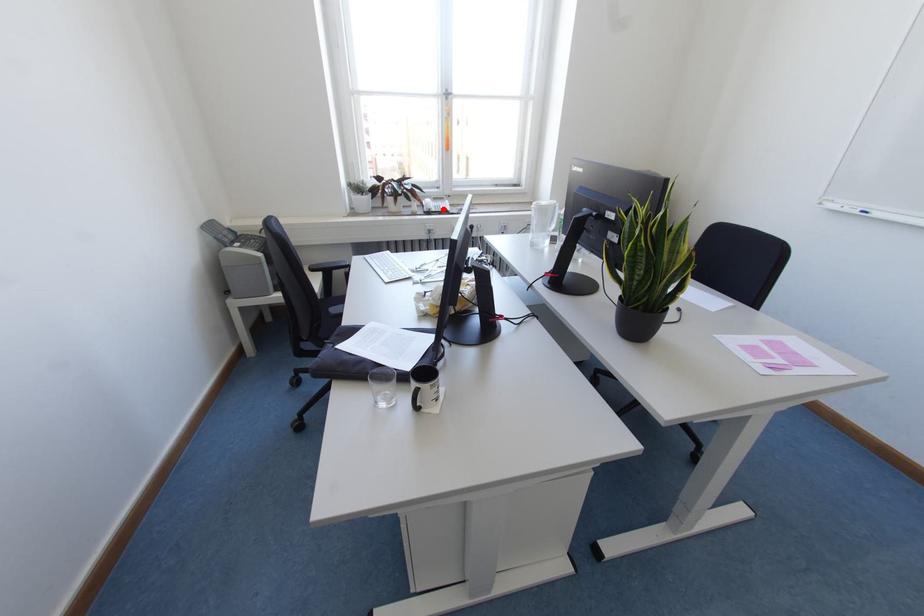
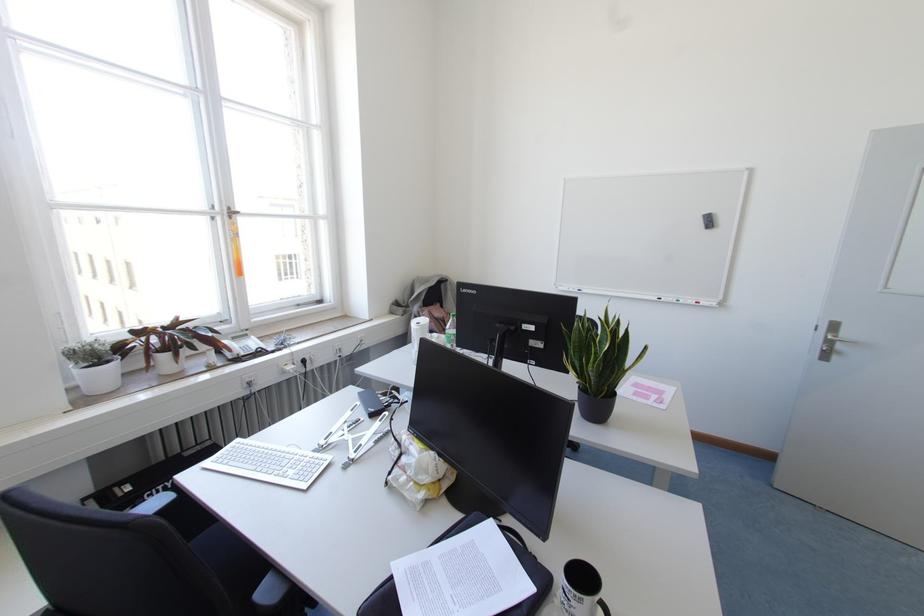
Question: I am providing you with two images of the same scene from different viewpoints. Given a red point in image1, look at the same physical point in image2. Is it:

Choices:
 (A) Closer to the viewpoint
 (B) Farther from the viewpoint

Answer: (A)